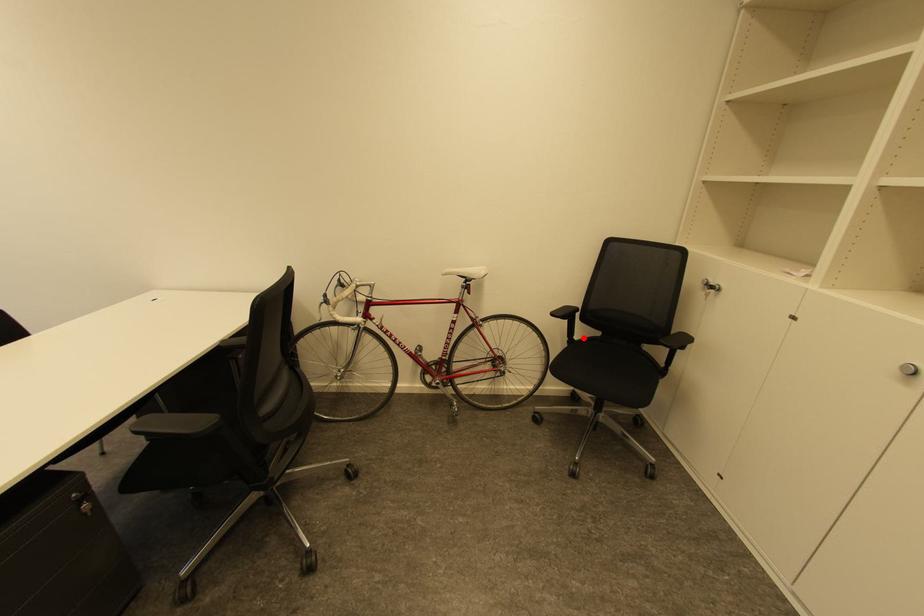
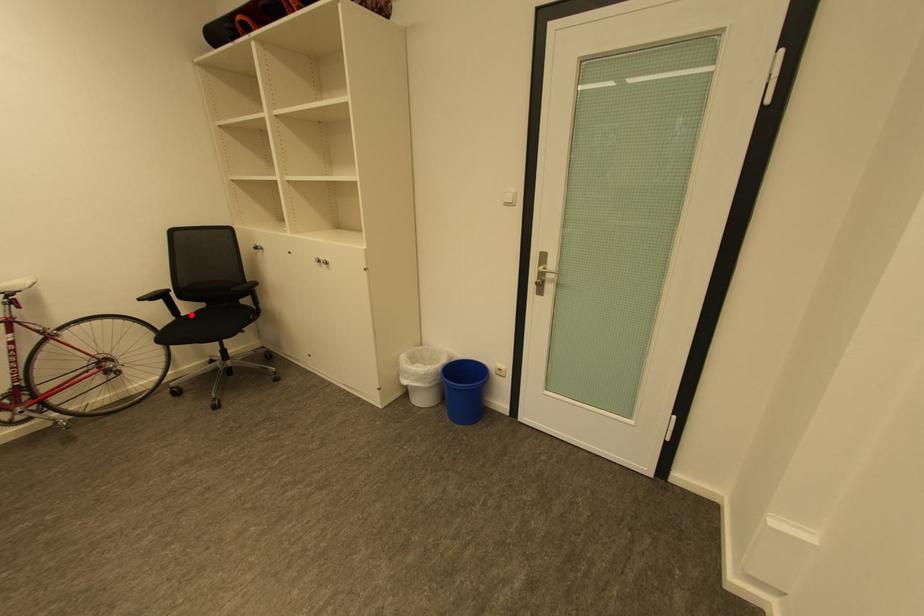
I am providing you with two images of the same scene from different viewpoints. A red point is marked on the first image and another point is marked on the second image. Is the red point in image1 aligned with the point shown in image2?

Yes